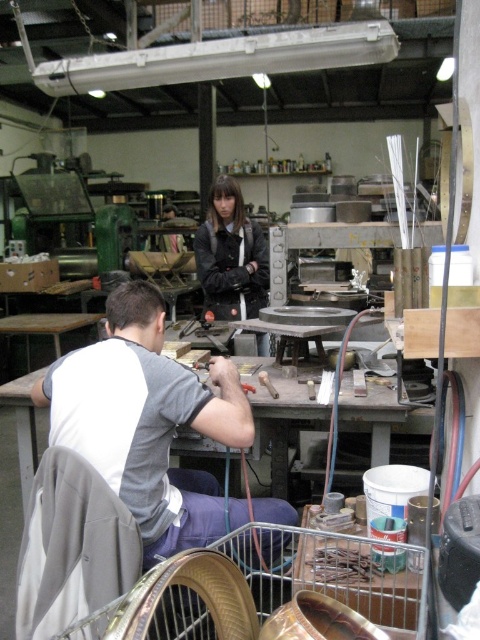
What is located at the point with coordinates (x=145, y=420) in the workshop scene?

The point at coordinates (x=145, y=420) indicates the gray cotton shirt at center.

You are a new worker in the workshop and need to locate the gray cotton shirt at center and the metallic gray table at center. According to the scene, which object is positioned to the left?

The gray cotton shirt at center is to the left of the metallic gray table at center.

What is located at the coordinates point (230, 256)?

The coordinates point (230, 256) indicate the location of the matte black jacket at center.